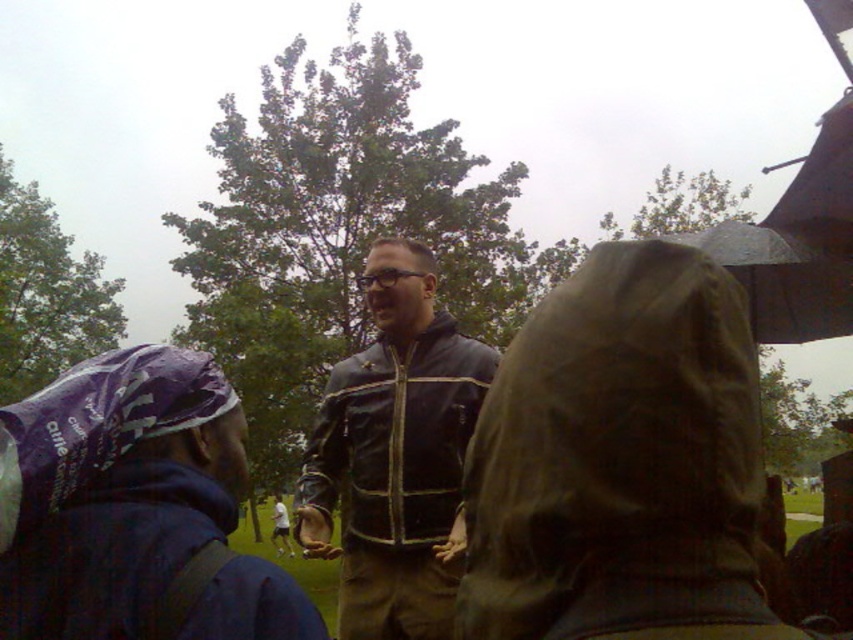
Question: Which is farther from the brown corduroy raincoat at center?

Choices:
 (A) purple fabric bandana at left
 (B) leather jacket at center

Answer: (B)

Question: Is purple fabric bandana at left in front of transparent plastic umbrella at upper right?

Choices:
 (A) no
 (B) yes

Answer: (B)

Question: Is purple fabric bandana at left below leather jacket at center?

Choices:
 (A) no
 (B) yes

Answer: (A)

Question: Is purple fabric bandana at left behind leather jacket at center?

Choices:
 (A) no
 (B) yes

Answer: (A)

Question: Which point is farther to the camera?

Choices:
 (A) coord(372,500)
 (B) coord(86,531)
 (C) coord(752,292)

Answer: (C)

Question: Among these points, which one is farthest from the camera?

Choices:
 (A) (743, 253)
 (B) (247, 628)
 (C) (341, 579)

Answer: (A)